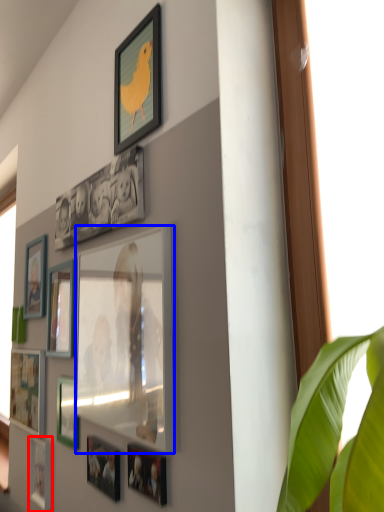
Question: Which object appears farthest to the camera in this image, picture frame (highlighted by a red box) or picture frame (highlighted by a blue box)?

Choices:
 (A) picture frame
 (B) picture frame

Answer: (A)